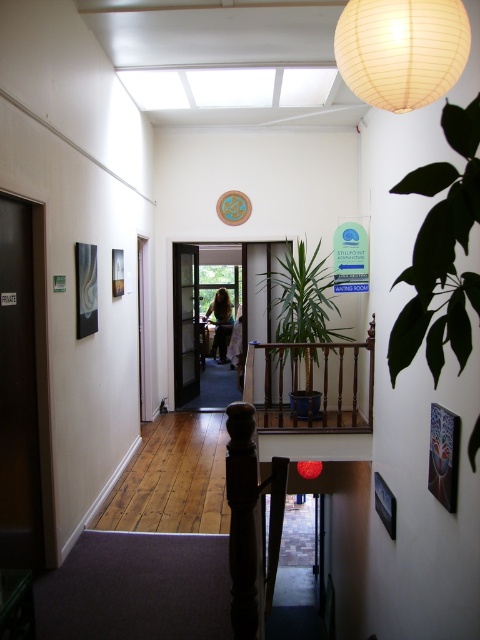
Describe the element at coordinates (312, 385) in the screenshot. I see `wooden at center` at that location.

Identify the location of wooden at center. (312, 385).

Does green leafy plant at center appear on the right side of wooden door at center?

Indeed, green leafy plant at center is positioned on the right side of wooden door at center.

Between green leafy plant at center and wooden door at center, which one has more height?

green leafy plant at center is taller.

Is point (287, 298) closer to camera compared to point (195, 312)?

Yes, point (287, 298) is in front of point (195, 312).

The image size is (480, 640). Identify the location of green leafy plant at center. (300, 298).

How far apart are wooden at center and wooden door at center?

7.25 meters

Between wooden at center and wooden door at center, which one has more height?

wooden at center

Image resolution: width=480 pixels, height=640 pixels. I want to click on wooden at center, so click(x=312, y=385).

Identify the location of wooden at center. (312, 385).